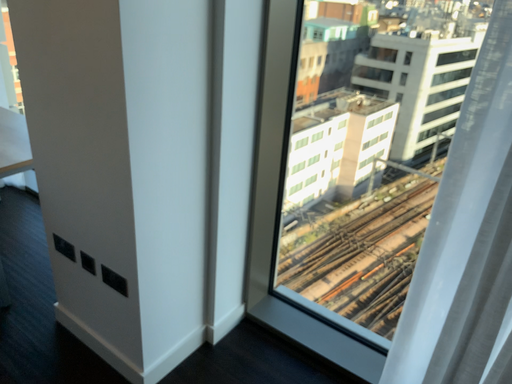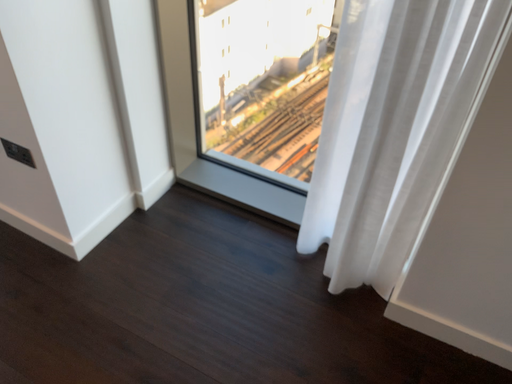
Question: How did the camera likely rotate when shooting the video?

Choices:
 (A) rotated left
 (B) rotated right

Answer: (B)